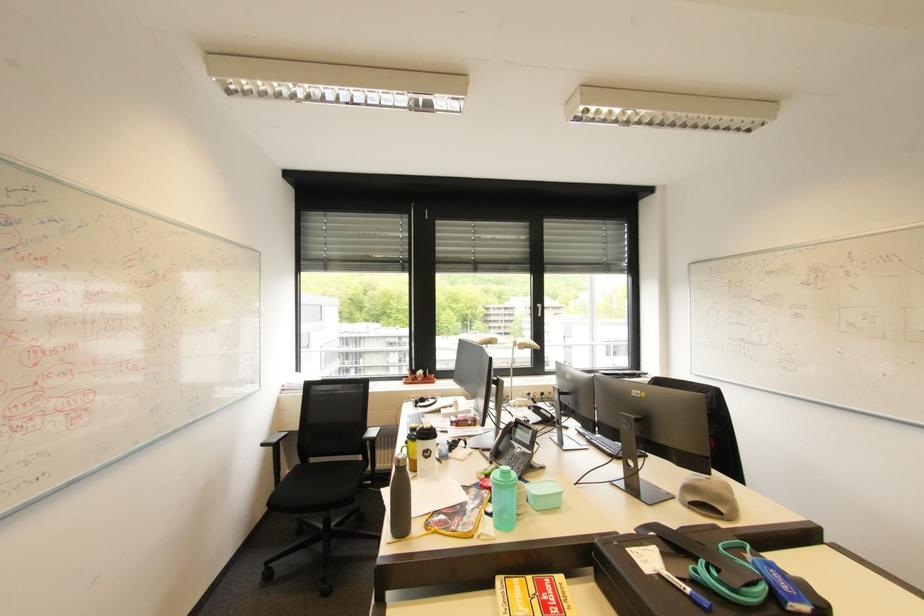
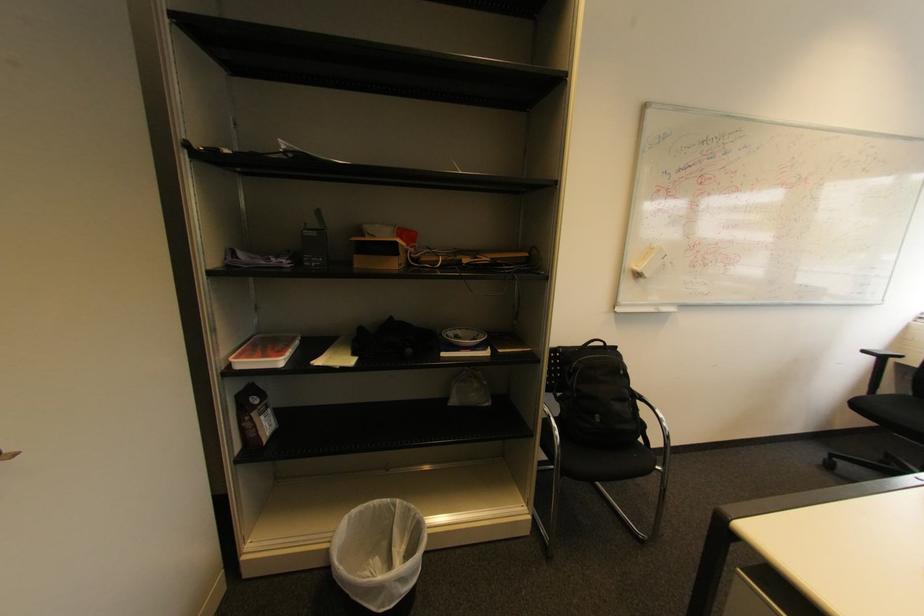
Locate, in the second image, the point that corresponds to point 268,446 in the first image.

(869, 352)